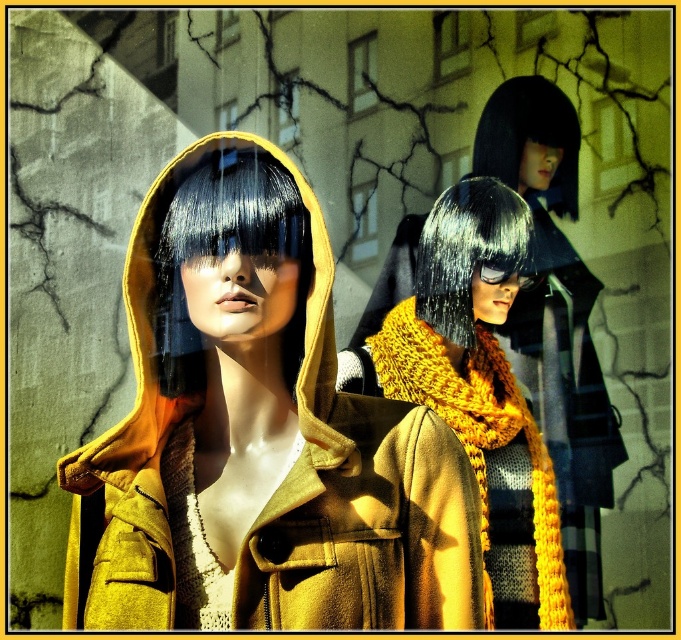
Question: Where is mustard woolen jacket at center located in relation to black silky hair at upper center in the image?

Choices:
 (A) below
 (B) above

Answer: (A)

Question: Does mustard woolen jacket at center have a larger size compared to knitted yellow scarf at center?

Choices:
 (A) yes
 (B) no

Answer: (B)

Question: Is mustard woolen jacket at center above knitted yellow scarf at center?

Choices:
 (A) yes
 (B) no

Answer: (A)

Question: Which object appears farthest from the camera in this image?

Choices:
 (A) shiny black hair at center
 (B) black silky hair at upper center
 (C) knitted yellow scarf at center
 (D) mustard woolen jacket at center

Answer: (B)

Question: Which point is closer to the camera?

Choices:
 (A) (560, 173)
 (B) (200, 356)
 (C) (253, 444)

Answer: (C)

Question: Based on their relative distances, which object is nearer to the black silky hair at upper center?

Choices:
 (A) knitted yellow scarf at center
 (B) black matte wig at center
 (C) mustard woolen jacket at center

Answer: (A)